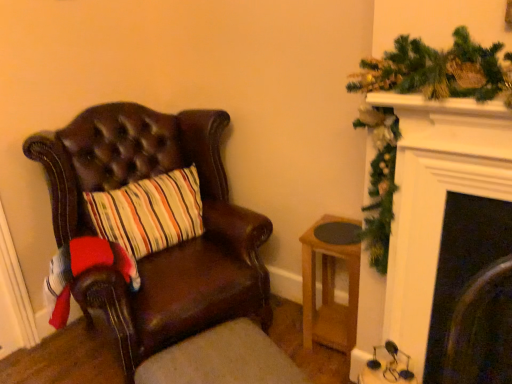
At what (x,y) coordinates should I click in order to perform the action: click on blank space above light brown wooden stool at lower right (from a real-world perspective). Please return your answer as a coordinate pair (x, y). The height and width of the screenshot is (384, 512). Looking at the image, I should click on point(344,228).